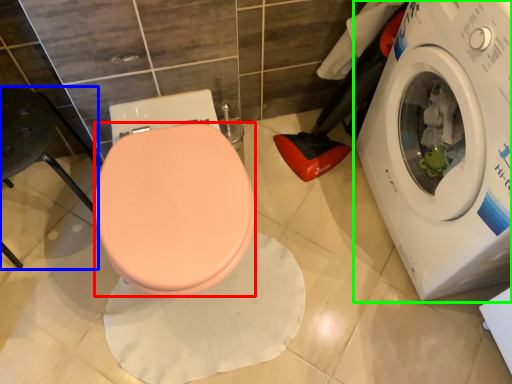
Question: Estimate the real-world distances between objects in this image. Which object is farther from bidet (highlighted by a red box), chair (highlighted by a blue box) or washing machine (highlighted by a green box)?

Choices:
 (A) chair
 (B) washing machine

Answer: (B)